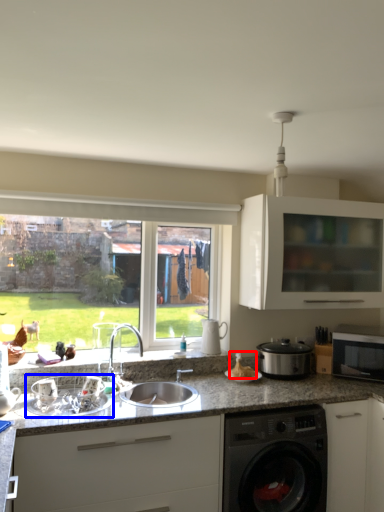
Question: Among these objects, which one is farthest to the camera, food (highlighted by a red box) or appliance (highlighted by a blue box)?

Choices:
 (A) food
 (B) appliance

Answer: (A)